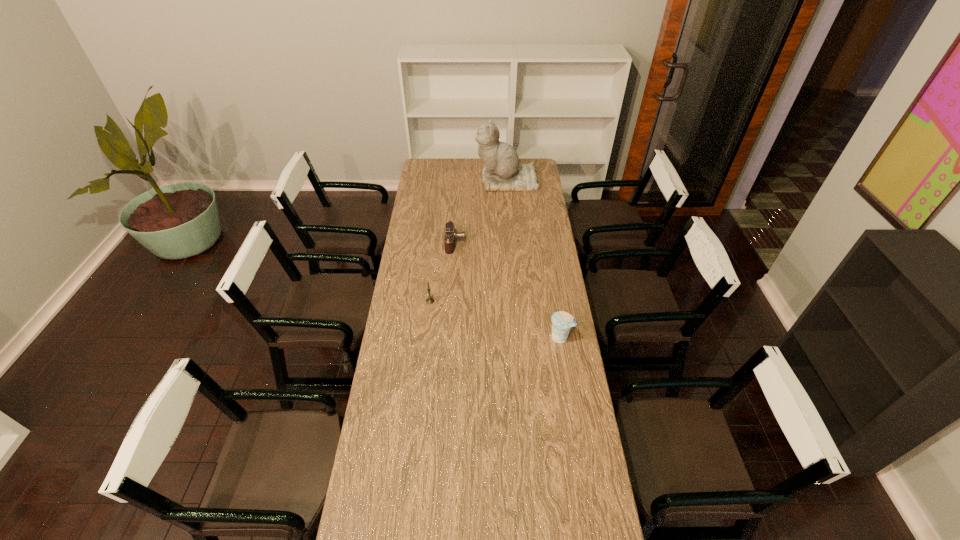
Where is `free spot located 0.130m on the left of the leftmost object`? This screenshot has height=540, width=960. free spot located 0.130m on the left of the leftmost object is located at coordinates (396, 301).

Where is `free space located on the front of the nearest object`? The width and height of the screenshot is (960, 540). free space located on the front of the nearest object is located at coordinates (566, 374).

I want to click on vacant space located 0.230m on the front-facing side of the camera, so [510, 243].

Identify the location of object at the far edge. 502,171.

Image resolution: width=960 pixels, height=540 pixels. I want to click on object that is at the left edge, so click(429, 300).

At what (x,y) coordinates should I click in order to perform the action: click on cat located in the right edge section of the desktop. Please return your answer as a coordinate pair (x, y). Looking at the image, I should click on (502, 171).

Locate an element on the screen. This screenshot has height=540, width=960. yogurt situated at the right edge is located at coordinates (562, 322).

Where is `object positioned at the far right corner`? object positioned at the far right corner is located at coordinates (502, 171).

Locate an element on the screen. vacant area at the far edge is located at coordinates (447, 170).

At what (x,y) coordinates should I click in order to perform the action: click on vacant space at the left edge of the desktop. Please return your answer as a coordinate pair (x, y). Looking at the image, I should click on (395, 307).